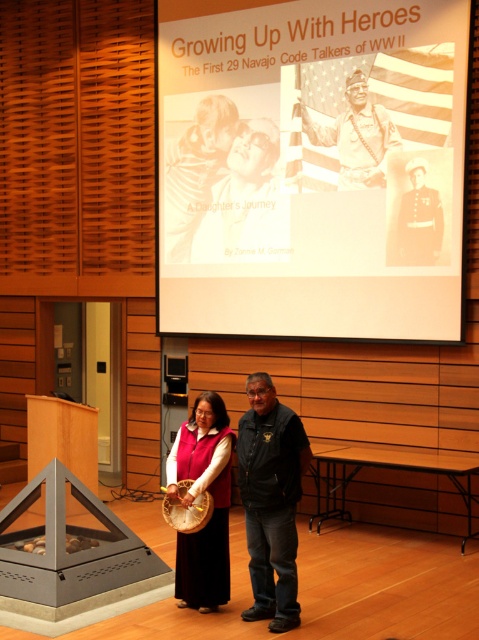
Can you confirm if white paper at upper center is positioned to the right of velvet red vest at center?

Correct, you'll find white paper at upper center to the right of velvet red vest at center.

Which is more to the right, white paper at upper center or velvet red vest at center?

From the viewer's perspective, white paper at upper center appears more on the right side.

Is point (456, 176) farther from camera compared to point (193, 586)?

Yes, it is behind point (193, 586).

Where is `white paper at upper center`? This screenshot has height=640, width=479. white paper at upper center is located at coordinates (311, 168).

Who is lower down, black leather jacket at center or velvet red vest at center?

Positioned lower is velvet red vest at center.

Does point (265, 394) lie behind point (195, 605)?

No, it is not.

Where is `black leather jacket at center`? black leather jacket at center is located at coordinates (271, 500).

I want to click on black leather jacket at center, so click(x=271, y=500).

Is point (244, 413) farther from viewer compared to point (340, 124)?

No.

Is black leather jacket at center taller than silvery metallic helmet at upper center?

Correct, black leather jacket at center is much taller as silvery metallic helmet at upper center.

Which is behind, point (283, 582) or point (384, 124)?

The point (384, 124) is more distant.

Identify the location of black leather jacket at center. (271, 500).